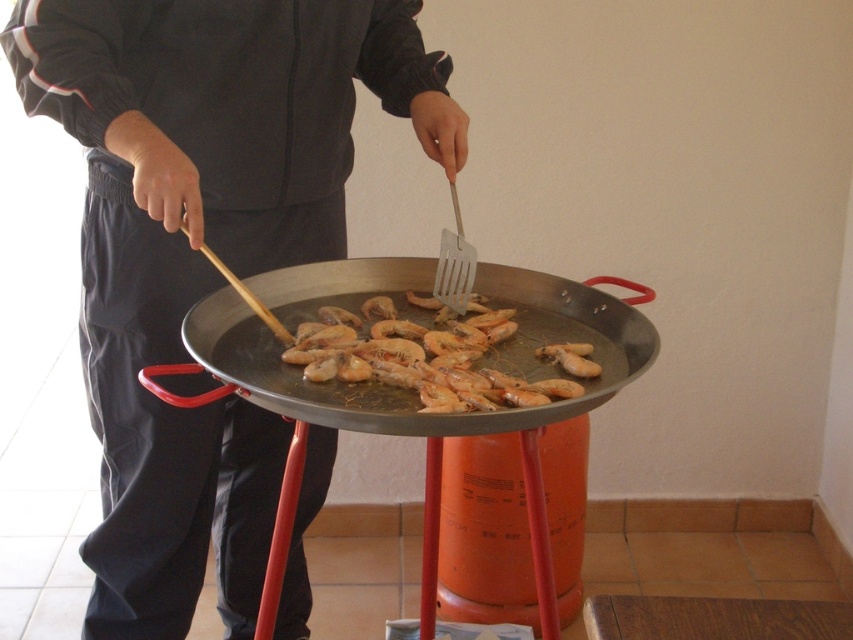
Question: Is shiny metal wok at center smaller than translucent orange shrimp at center?

Choices:
 (A) no
 (B) yes

Answer: (A)

Question: Is dark gray fabric jacket at center above shiny metal wok at center?

Choices:
 (A) no
 (B) yes

Answer: (A)

Question: Can you confirm if shiny metal wok at center is positioned to the right of translucent orange shrimp at center?

Choices:
 (A) yes
 (B) no

Answer: (B)

Question: Which object appears closest to the camera in this image?

Choices:
 (A) shiny golden shrimp at center
 (B) translucent orange shrimp at center

Answer: (A)

Question: Which object appears closest to the camera in this image?

Choices:
 (A) dark gray fabric jacket at center
 (B) translucent orange shrimp at center
 (C) shiny metal wok at center

Answer: (C)

Question: Which of the following is the closest to the observer?

Choices:
 (A) shiny golden shrimp at center
 (B) shiny metal wok at center

Answer: (B)